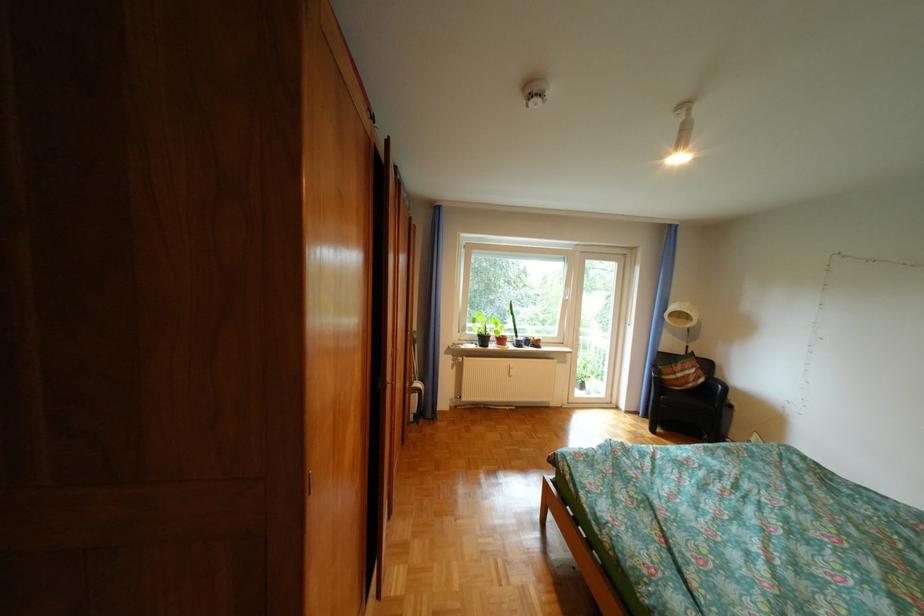
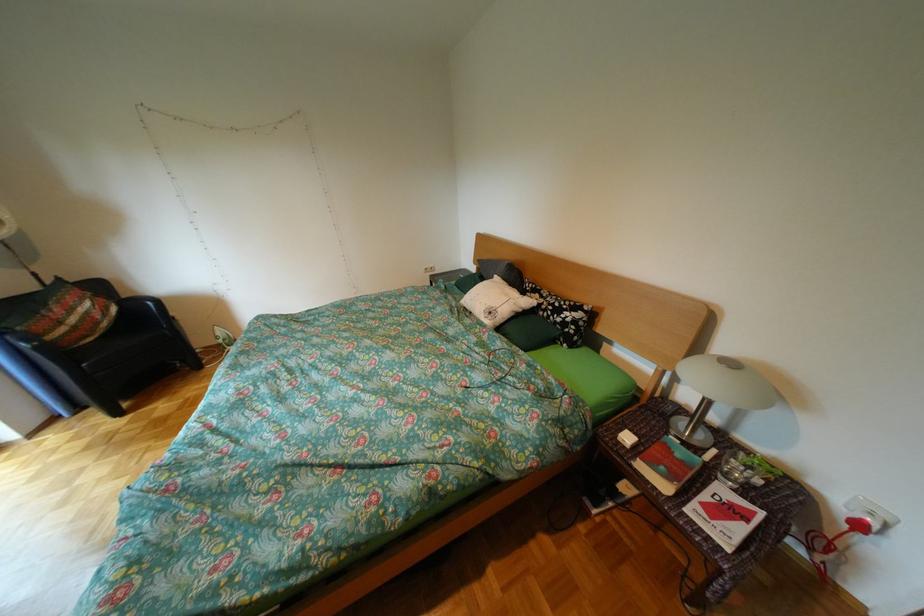
The first image is from the beginning of the video and the second image is from the end. How did the camera likely rotate when shooting the video?

The camera rotated toward right-down.